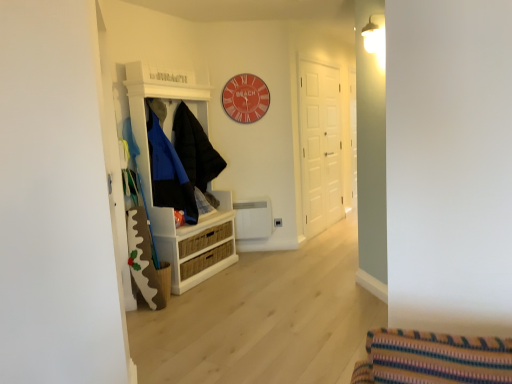
Question: Is white wood cabinet at left shorter than white matte door at center?

Choices:
 (A) no
 (B) yes

Answer: (B)

Question: Is white matte door at center surrounded by white wood cabinet at left?

Choices:
 (A) yes
 (B) no

Answer: (B)

Question: From a real-world perspective, is white wood cabinet at left positioned over white matte door at center based on gravity?

Choices:
 (A) yes
 (B) no

Answer: (B)

Question: Is white wood cabinet at left outside white matte door at center?

Choices:
 (A) yes
 (B) no

Answer: (A)

Question: From a real-world perspective, is white wood cabinet at left below white matte door at center?

Choices:
 (A) no
 (B) yes

Answer: (B)

Question: In terms of width, does matte black jacket at left, which ranks as the 2th clothing in back-to-front order, look wider or thinner when compared to black puffy jacket at center, the 1th clothing positioned from the back?

Choices:
 (A) wide
 (B) thin

Answer: (A)

Question: Would you say matte black jacket at left, which ranks as the 2th clothing in back-to-front order, is to the left or to the right of black puffy jacket at center, the 1th clothing positioned from the back, in the picture?

Choices:
 (A) right
 (B) left

Answer: (B)

Question: Which is correct: matte black jacket at left, the first clothing when ordered from front to back, is inside black puffy jacket at center, which appears as the second clothing when viewed from the front, or outside of it?

Choices:
 (A) outside
 (B) inside

Answer: (A)

Question: From the image's perspective, relative to black puffy jacket at center, which appears as the second clothing when viewed from the front, is matte black jacket at left, which ranks as the 2th clothing in back-to-front order, above or below?

Choices:
 (A) below
 (B) above

Answer: (A)

Question: Based on their positions, is matte red clock at upper center located to the left or right of white wood cabinet at left?

Choices:
 (A) left
 (B) right

Answer: (B)

Question: From the image's perspective, is matte red clock at upper center positioned above or below white wood cabinet at left?

Choices:
 (A) above
 (B) below

Answer: (A)

Question: In the image, is matte red clock at upper center positioned in front of or behind white wood cabinet at left?

Choices:
 (A) behind
 (B) front

Answer: (A)

Question: From their relative heights in the image, would you say matte red clock at upper center is taller or shorter than white wood cabinet at left?

Choices:
 (A) short
 (B) tall

Answer: (A)

Question: Is white wood cabinet at left inside the boundaries of white matte door at center, or outside?

Choices:
 (A) outside
 (B) inside

Answer: (A)

Question: Relative to white matte door at center, is white wood cabinet at left in front or behind?

Choices:
 (A) front
 (B) behind

Answer: (A)